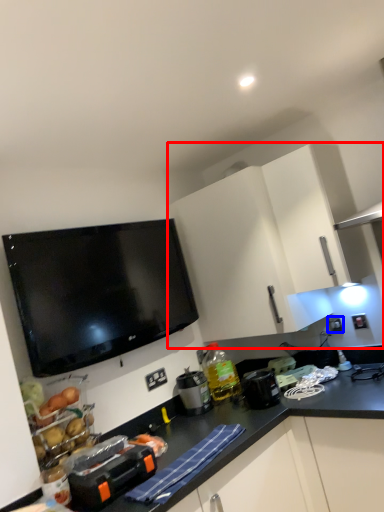
Question: Which of the following is the closest to the observer, cabinetry (highlighted by a red box) or electric outlet (highlighted by a blue box)?

Choices:
 (A) cabinetry
 (B) electric outlet

Answer: (A)